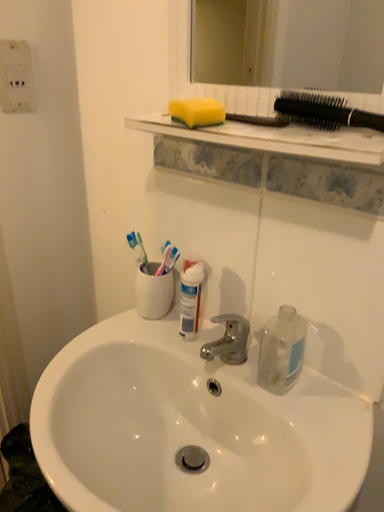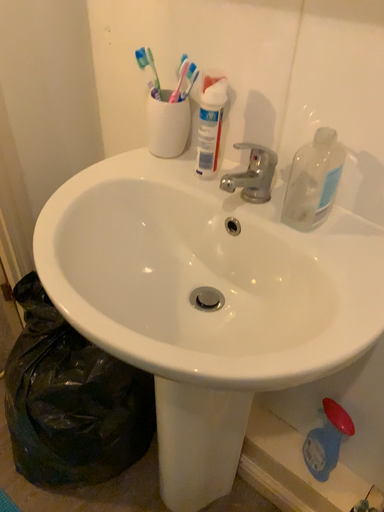
Question: How did the camera likely rotate when shooting the video?

Choices:
 (A) rotated downward
 (B) rotated upward

Answer: (A)